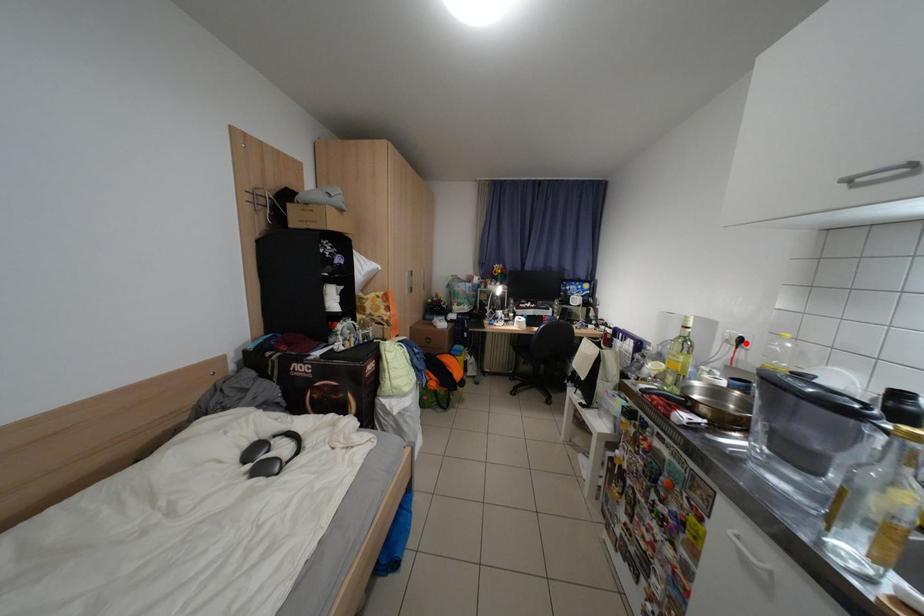
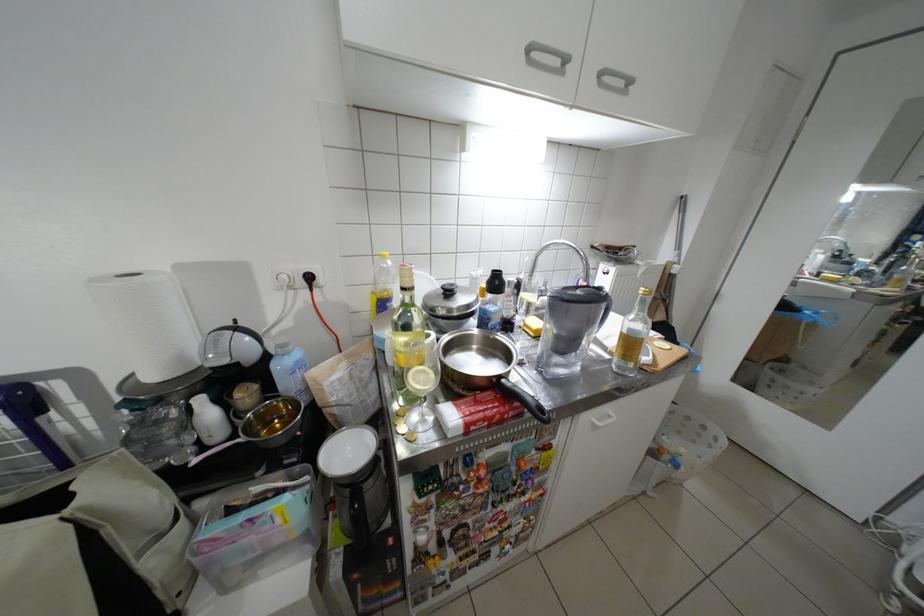
Find the pixel in the second image that matches the highlighted location in the first image.

(312, 285)